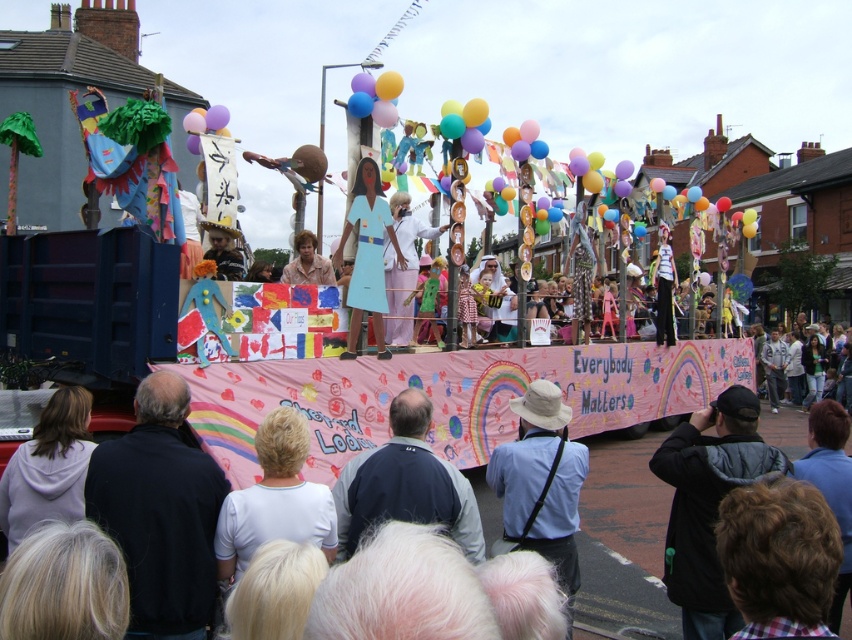
Question: Does black jacket at lower right appear on the right side of brown hair at lower right?

Choices:
 (A) yes
 (B) no

Answer: (A)

Question: Can you confirm if blue fabric at center is positioned to the right of matte yellow shirt at center?

Choices:
 (A) yes
 (B) no

Answer: (A)

Question: Which point appears farthest from the camera in this image?

Choices:
 (A) [x=698, y=579]
 (B) [x=753, y=524]

Answer: (A)

Question: Based on their relative distances, which object is nearer to the white matte shirt at lower center?

Choices:
 (A) black jacket at lower right
 (B) pink fabric dress at center
 (C) light purple hoodie at lower left
 (D) matte yellow shirt at center

Answer: (C)

Question: Does light purple hoodie at lower left appear under matte yellow shirt at center?

Choices:
 (A) no
 (B) yes

Answer: (B)

Question: Among these points, which one is nearest to the camera?

Choices:
 (A) (232, 554)
 (B) (386, 225)
 (C) (294, 266)
 (D) (766, 483)

Answer: (D)